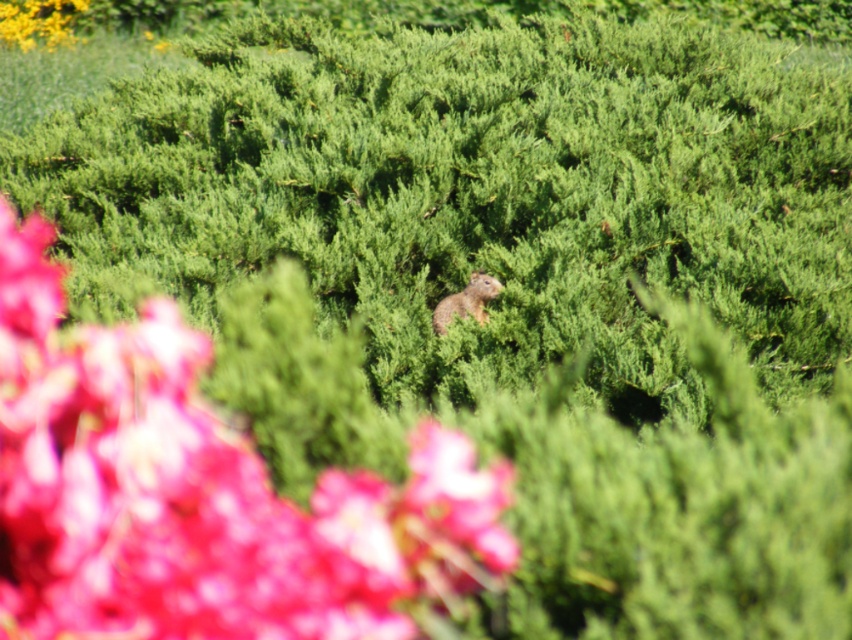
You are a botanist examining the image. You notice a point marked at coordinates (200, 493). Based on the scene description, what object does this point most likely correspond to?

The point at coordinates (200, 493) corresponds to the matte pink petals at center.

You are a photographer trying to capture the matte pink petals at center in focus. The camera is currently focused on the point at coordinates point (200, 493). Is the camera focused on the matte pink petals at center?

Yes, the camera is focused on the matte pink petals at center because the point (200, 493) represents the matte pink petals at center.